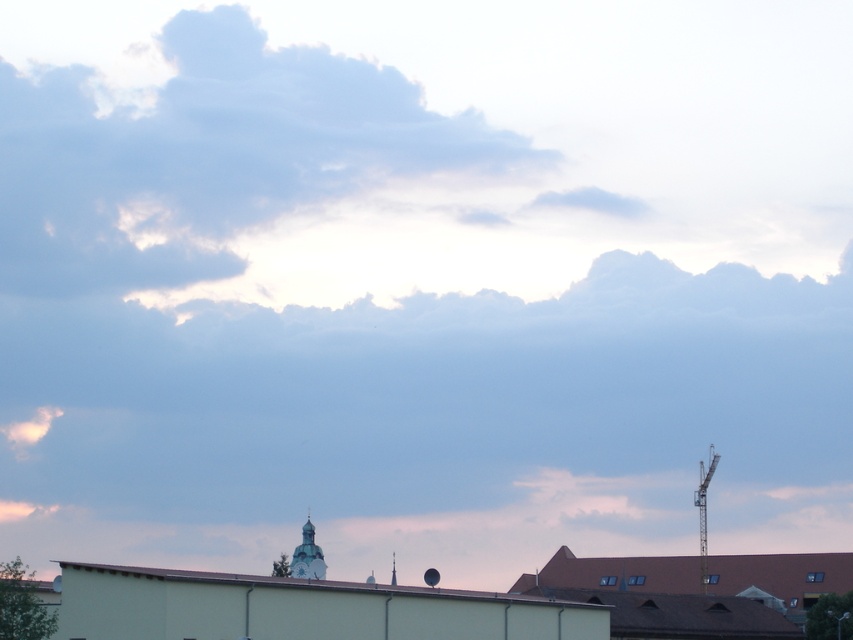
How much distance is there between white stone tower at center and metallic gray crane at right?

The distance of white stone tower at center from metallic gray crane at right is 65.30 meters.

Who is more forward, (294, 570) or (698, 497)?

Point (294, 570) is in front.

This screenshot has height=640, width=853. What are the coordinates of `white stone tower at center` in the screenshot? It's located at (306, 556).

In the scene shown: Between white stone tower at center and metallic silver clock at center, which one is positioned higher?

white stone tower at center

Between white stone tower at center and metallic silver clock at center, which one is positioned lower?

metallic silver clock at center

Which is in front, point (300, 541) or point (291, 566)?

Positioned in front is point (291, 566).

The image size is (853, 640). In order to click on white stone tower at center in this screenshot , I will do `click(306, 556)`.

Which is in front, point (699, 515) or point (300, 572)?

Point (300, 572) is more forward.

Is metallic gray crane at right to the right of metallic silver clock at center from the viewer's perspective?

Indeed, metallic gray crane at right is positioned on the right side of metallic silver clock at center.

Is point (700, 515) more distant than point (299, 563)?

That is True.

I want to click on metallic gray crane at right, so click(x=704, y=513).